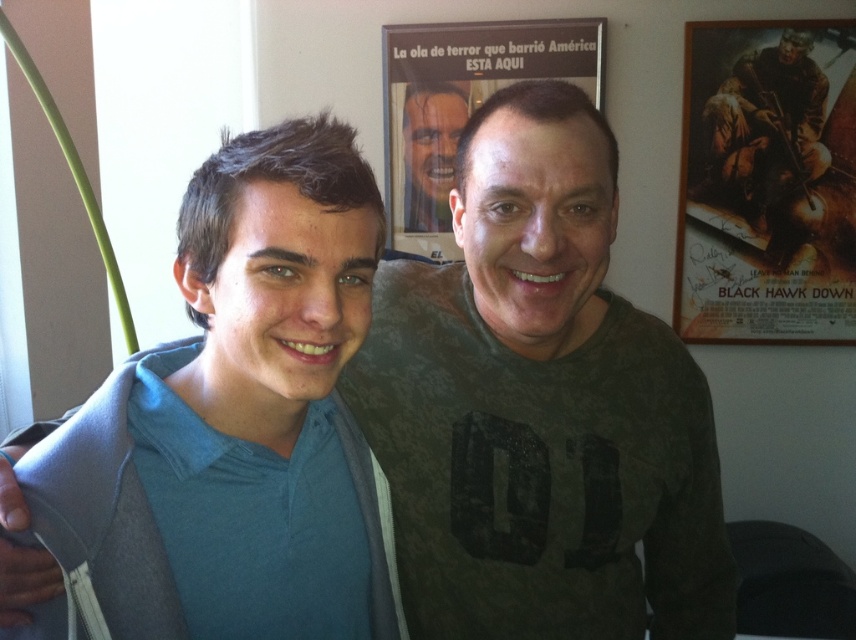
Question: Does blue cotton shirt at left appear over matte black face at center?

Choices:
 (A) no
 (B) yes

Answer: (A)

Question: From the image, what is the correct spatial relationship of dark green textured shirt at center in relation to brown cardboard poster at upper right?

Choices:
 (A) right
 (B) left

Answer: (B)

Question: Among these points, which one is nearest to the camera?

Choices:
 (A) (446, 564)
 (B) (728, 205)
 (C) (435, 225)
 (D) (354, 314)

Answer: (D)

Question: Estimate the real-world distances between objects in this image. Which object is farther from the matte black face at center?

Choices:
 (A) dark green textured shirt at center
 (B) blue cotton shirt at left

Answer: (B)

Question: Does brown cardboard poster at upper right appear on the left side of matte black face at center?

Choices:
 (A) no
 (B) yes

Answer: (A)

Question: Which of the following is the closest to the observer?

Choices:
 (A) blue cotton shirt at left
 (B) dark green textured shirt at center
 (C) matte black face at center
 (D) brown cardboard poster at upper right

Answer: (A)